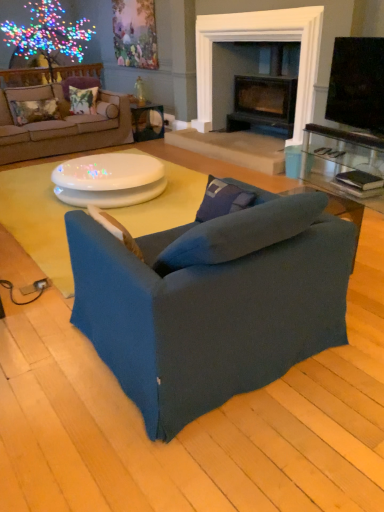
Question: Does floral fabric pillow at upper left, which is counted as the 4th pillow, starting from the front, have a larger size compared to dark blue fabric studio couch at center, the 1th studio couch in the bottom-to-top sequence?

Choices:
 (A) yes
 (B) no

Answer: (B)

Question: Is the position of floral fabric pillow at upper left, the first pillow viewed from the top, less distant than that of dark blue fabric studio couch at center, arranged as the second studio couch when viewed from the back?

Choices:
 (A) no
 (B) yes

Answer: (A)

Question: Would you say dark blue fabric studio couch at center, which is the first studio couch from front to back, is part of floral fabric pillow at upper left, the first pillow viewed from the top,'s contents?

Choices:
 (A) yes
 (B) no

Answer: (B)

Question: Is floral fabric pillow at upper left, placed as the first pillow when sorted from back to front, wider than dark blue fabric studio couch at center, the 1th studio couch in the bottom-to-top sequence?

Choices:
 (A) no
 (B) yes

Answer: (A)

Question: Considering the relative sizes of floral fabric pillow at upper left, which is counted as the 4th pillow, starting from the front, and dark blue fabric studio couch at center, arranged as the second studio couch when viewed from the back, in the image provided, is floral fabric pillow at upper left, which is counted as the 4th pillow, starting from the front, shorter than dark blue fabric studio couch at center, arranged as the second studio couch when viewed from the back,?

Choices:
 (A) yes
 (B) no

Answer: (A)

Question: From the image's perspective, is beige fabric couch at upper left, the 2th studio couch when ordered from front to back, positioned above or below white glossy coffee table at center?

Choices:
 (A) above
 (B) below

Answer: (A)

Question: Is point (107, 95) closer or farther from the camera than point (67, 287)?

Choices:
 (A) farther
 (B) closer

Answer: (A)

Question: Is beige fabric couch at upper left, which is the second studio couch in bottom-to-top order, situated inside white glossy coffee table at center or outside?

Choices:
 (A) outside
 (B) inside

Answer: (A)

Question: Considering the positions of beige fabric couch at upper left, arranged as the first studio couch when viewed from the top, and white glossy coffee table at center in the image, is beige fabric couch at upper left, arranged as the first studio couch when viewed from the top, wider or thinner than white glossy coffee table at center?

Choices:
 (A) wide
 (B) thin

Answer: (B)

Question: Is white glossy coffee table at center wider or thinner than silky floral pillow at upper left, which appears as the third pillow when viewed from the front?

Choices:
 (A) thin
 (B) wide

Answer: (B)

Question: Considering their positions, is white glossy coffee table at center located in front of or behind silky floral pillow at upper left, the 3th pillow from the bottom?

Choices:
 (A) front
 (B) behind

Answer: (A)

Question: Looking at the image, does white glossy coffee table at center seem bigger or smaller compared to silky floral pillow at upper left, which ranks as the 2th pillow in right-to-left order?

Choices:
 (A) small
 (B) big

Answer: (B)

Question: Choose the correct answer: Is white glossy coffee table at center inside silky floral pillow at upper left, which appears as the third pillow when viewed from the front, or outside it?

Choices:
 (A) outside
 (B) inside

Answer: (A)

Question: From a real-world perspective, relative to matte white table at center, arranged as the second table when viewed from the front, is suede-like blue pillow at center, marked as the 1th pillow in a right-to-left arrangement, vertically above or below?

Choices:
 (A) above
 (B) below

Answer: (A)

Question: In terms of size, does suede-like blue pillow at center, the 4th pillow in the back-to-front sequence, appear bigger or smaller than matte white table at center, which ranks as the 1th table in top-to-bottom order?

Choices:
 (A) big
 (B) small

Answer: (B)